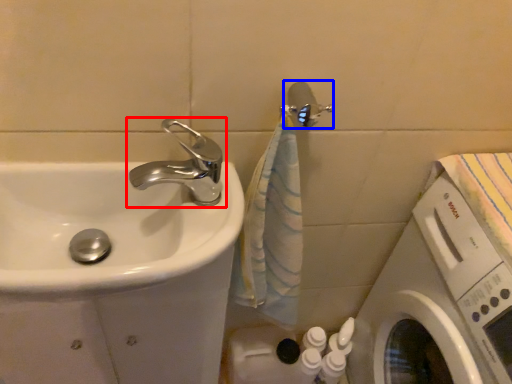
Question: Which object is further to the camera taking this photo, tap (highlighted by a red box) or shower (highlighted by a blue box)?

Choices:
 (A) tap
 (B) shower

Answer: (B)